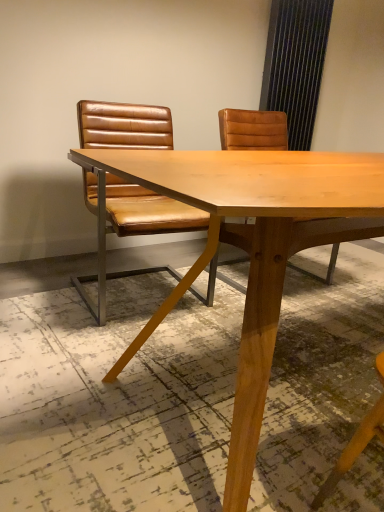
Describe the element at coordinates (251, 248) in the screenshot. The image size is (384, 512). I see `light brown wood table at center` at that location.

Identify the location of light brown wood table at center. (251, 248).

The image size is (384, 512). What do you see at coordinates (131, 225) in the screenshot?
I see `brown leather chair at left` at bounding box center [131, 225].

You are a GUI agent. You are given a task and a screenshot of the screen. Output one action in this format:
    pyautogui.click(x=<x>, y=<y>)
    Task: Click on the brown leather chair at left
    This screenshot has height=512, width=384.
    Given the screenshot: What is the action you would take?
    pyautogui.click(x=131, y=225)

This screenshot has height=512, width=384. Identify the location of light brown wood table at center. (251, 248).

Visually, is light brown wood table at center positioned to the left or to the right of brown leather chair at left?

Clearly, light brown wood table at center is on the right of brown leather chair at left in the image.

Which object is further away from the camera, light brown wood table at center or brown leather chair at left?

brown leather chair at left is further away from the camera.

Considering the points (355, 162) and (156, 219), which point is behind, point (355, 162) or point (156, 219)?

The point (156, 219) is farther from the camera.

From the image's perspective, would you say light brown wood table at center is positioned over brown leather chair at left?

No, from the image's perspective, light brown wood table at center is not above brown leather chair at left.

From a real-world perspective, does light brown wood table at center sit lower than brown leather chair at left?

Yes, from a real-world perspective, light brown wood table at center is under brown leather chair at left.

Which of these two, light brown wood table at center or brown leather chair at left, is thinner?

With smaller width is brown leather chair at left.

Considering the sizes of objects light brown wood table at center and brown leather chair at left in the image provided, who is shorter, light brown wood table at center or brown leather chair at left?

light brown wood table at center is shorter.

Does light brown wood table at center have a smaller size compared to brown leather chair at left?

Incorrect, light brown wood table at center is not smaller in size than brown leather chair at left.

Which is correct: light brown wood table at center is inside brown leather chair at left, or outside of it?

The correct answer is: outside.

Looking at this image, is light brown wood table at center placed right next to brown leather chair at left?

There is a gap between light brown wood table at center and brown leather chair at left.

Is light brown wood table at center facing towards brown leather chair at left?

No, light brown wood table at center is not turned towards brown leather chair at left.

Locate an element on the screen. The width and height of the screenshot is (384, 512). table below the brown leather chair at left (from a real-world perspective) is located at coordinates (251, 248).

From the picture: Based on their positions, is brown leather chair at left located to the left or right of light brown wood table at center?

Based on their positions, brown leather chair at left is located to the left of light brown wood table at center.

Which object is closer to the camera taking this photo, brown leather chair at left or light brown wood table at center?

light brown wood table at center.

Considering the points (133, 184) and (258, 387), which point is behind, point (133, 184) or point (258, 387)?

The point (133, 184) is farther from the camera.

From the image's perspective, which is above, brown leather chair at left or light brown wood table at center?

brown leather chair at left is shown above in the image.

Based on the photo, from a real-world perspective, relative to light brown wood table at center, is brown leather chair at left vertically above or below?

Clearly, from a real-world perspective, brown leather chair at left is above light brown wood table at center.

Looking at this image, looking at their sizes, would you say brown leather chair at left is wider or thinner than light brown wood table at center?

brown leather chair at left is thinner than light brown wood table at center.

In the scene shown: Considering the relative sizes of brown leather chair at left and light brown wood table at center in the image provided, is brown leather chair at left taller than light brown wood table at center?

Correct, brown leather chair at left is much taller as light brown wood table at center.

Which of these two, brown leather chair at left or light brown wood table at center, is smaller?

Smaller between the two is brown leather chair at left.

Can we say brown leather chair at left lies outside light brown wood table at center?

brown leather chair at left lies outside light brown wood table at center's area.

Looking at this image, is brown leather chair at left next to light brown wood table at center?

brown leather chair at left is not next to light brown wood table at center, and they're not touching.

Does brown leather chair at left turn towards light brown wood table at center?

Yes, brown leather chair at left is aimed at light brown wood table at center.

Can you tell me how much brown leather chair at left and light brown wood table at center differ in facing direction?

2.74 degrees.

How much distance is there between brown leather chair at left and light brown wood table at center?

brown leather chair at left and light brown wood table at center are 26.64 inches apart from each other.

Locate an element on the screen. chair located on the left of light brown wood table at center is located at coordinates (131, 225).

This screenshot has height=512, width=384. What are the coordinates of `chair on the left side of light brown wood table at center` in the screenshot? It's located at (131, 225).

The image size is (384, 512). I want to click on table in front of the brown leather chair at left, so click(251, 248).